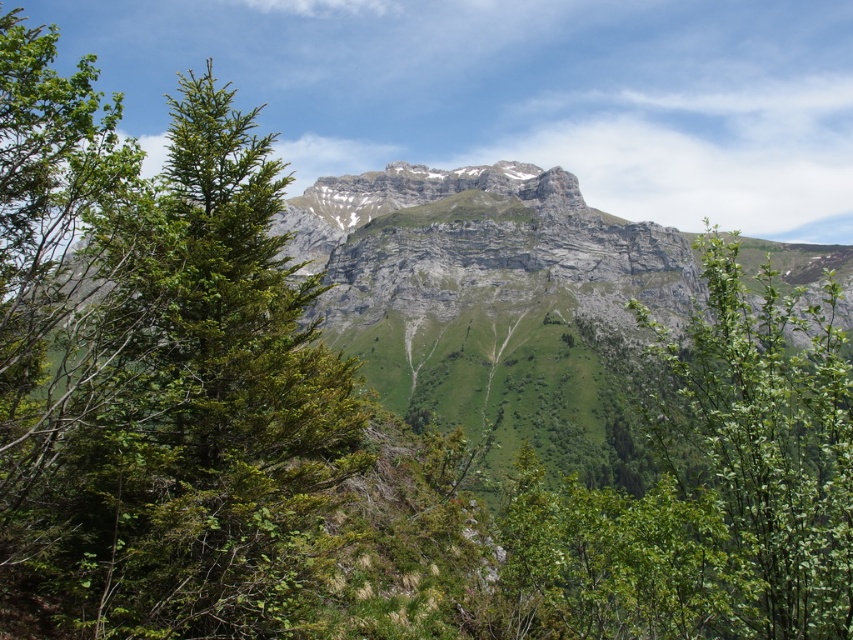
Question: Where is green needle-like tree at center-left located in relation to green leafy shrub at center in the image?

Choices:
 (A) left
 (B) right

Answer: (A)

Question: From the image, what is the correct spatial relationship of gray rocky mountain range at center in relation to green leafy shrub at center?

Choices:
 (A) right
 (B) left

Answer: (B)

Question: Which of the following is the farthest from the observer?

Choices:
 (A) (723, 417)
 (B) (53, 476)

Answer: (B)

Question: Can you confirm if green needle-like tree at center-left is positioned to the left of green leafy shrub at center?

Choices:
 (A) yes
 (B) no

Answer: (A)

Question: Which object appears closest to the camera in this image?

Choices:
 (A) green needle-like tree at center-left
 (B) gray rocky mountain range at center

Answer: (A)

Question: Which object appears closest to the camera in this image?

Choices:
 (A) gray rocky mountain range at center
 (B) green leafy shrub at center
 (C) green needle-like tree at center-left

Answer: (B)